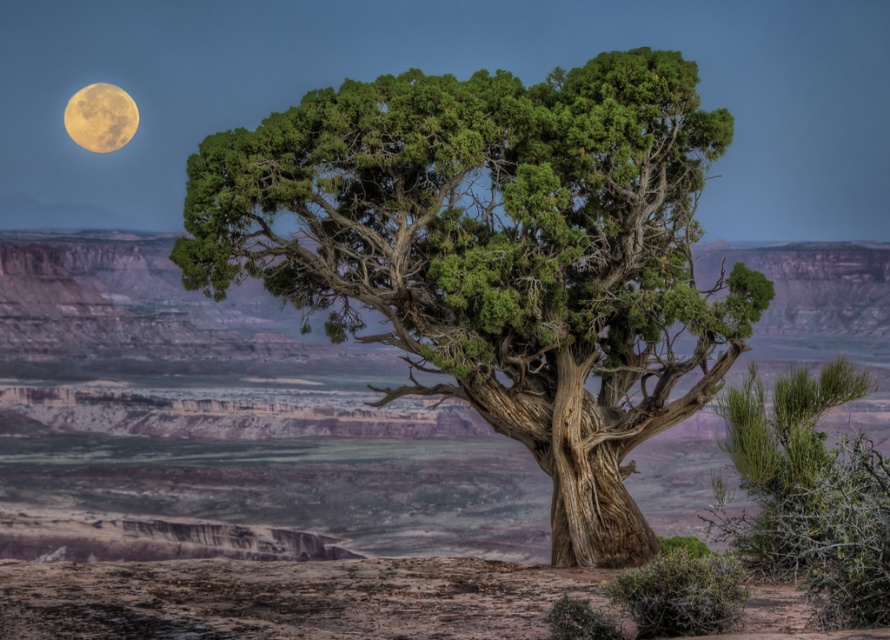
Question: Does green textured tree at center appear over yellowish matte moon at upper left?

Choices:
 (A) yes
 (B) no

Answer: (B)

Question: Which object appears farthest from the camera in this image?

Choices:
 (A) green textured tree at center
 (B) yellowish matte moon at upper left

Answer: (B)

Question: Which of the following is the closest to the observer?

Choices:
 (A) yellowish matte moon at upper left
 (B) green textured tree at center

Answer: (B)

Question: Is green textured tree at center closer to the viewer compared to yellowish matte moon at upper left?

Choices:
 (A) no
 (B) yes

Answer: (B)

Question: Is green textured tree at center behind yellowish matte moon at upper left?

Choices:
 (A) no
 (B) yes

Answer: (A)